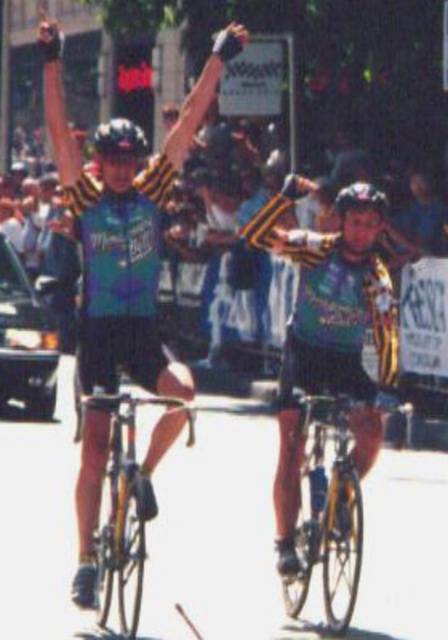
Question: Among these objects, which one is nearest to the camera?

Choices:
 (A) black matte bicycle helmet at upper center
 (B) shiny metallic bicycle at center

Answer: (B)

Question: Which object is the closest to the black matte bicycle helmet at upper center?

Choices:
 (A) black matte bicycle helmet at center
 (B) yellow matte bicycle at center
 (C) shiny metallic bicycle at center

Answer: (C)

Question: Is shiny metallic bicycle at center positioned in front of black matte bicycle helmet at center?

Choices:
 (A) no
 (B) yes

Answer: (B)

Question: Does black matte bicycle helmet at upper center have a smaller size compared to black matte bicycle helmet at center?

Choices:
 (A) no
 (B) yes

Answer: (A)

Question: Among these objects, which one is farthest from the camera?

Choices:
 (A) black matte bicycle helmet at upper center
 (B) yellow matte bicycle at center

Answer: (A)

Question: Is yellow matte bicycle at center to the right of shiny metallic bicycle at center from the viewer's perspective?

Choices:
 (A) yes
 (B) no

Answer: (A)